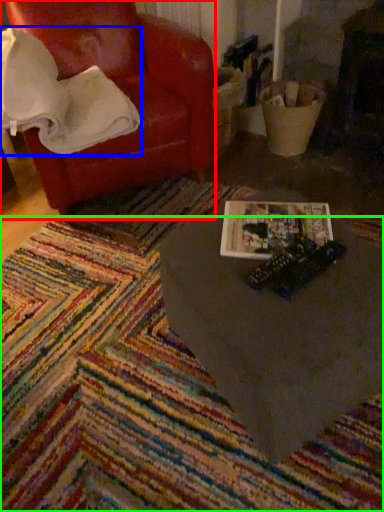
Question: Which is nearer to the chair (highlighted by a red box)? blanket (highlighted by a blue box) or mat (highlighted by a green box).

Choices:
 (A) blanket
 (B) mat

Answer: (A)